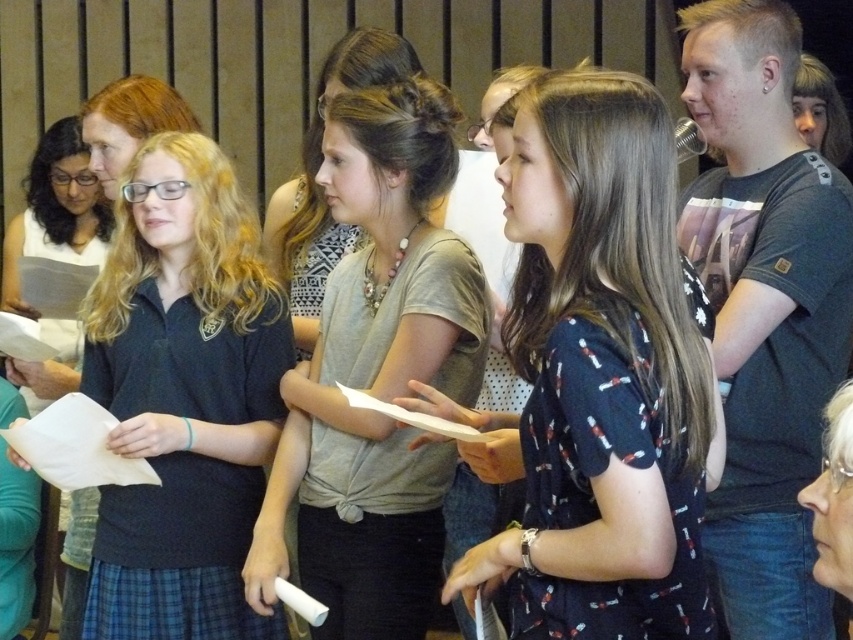
You are a photographer positioned in front of the group. You need to capture a photo where both the dark blue printed dress at center and the dark blue uniform at center are clearly visible. Based on their sizes, which one should you ensure is closer to the camera to avoid being obscured?

The dark blue printed dress at center is smaller than the dark blue uniform at center. To ensure both are clearly visible, you should position the dark blue printed dress at center closer to the camera so it appears larger in the photo and isn not obscured by the larger dark blue uniform at center.

Consider the image. You are an observer standing in front of the stage. You notice two people in the center of the group wearing the dark blue uniform at center and the matte gray shirt at center. Which one is closer to you?

The dark blue uniform at center is closer to you because the matte gray shirt at center is behind it.